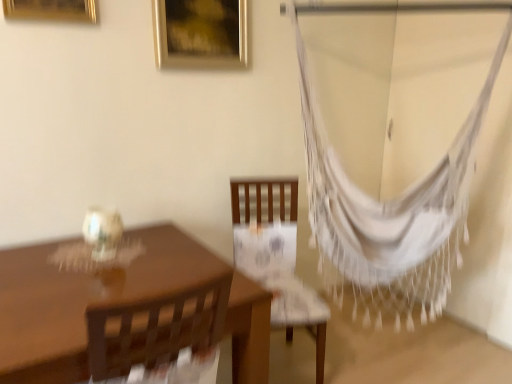
Question: Based on their positions, is white woven hammock at right located to the left or right of wooden chair at center?

Choices:
 (A) right
 (B) left

Answer: (A)

Question: Considering the positions of point (409, 200) and point (241, 187), is point (409, 200) closer or farther from the camera than point (241, 187)?

Choices:
 (A) closer
 (B) farther

Answer: (A)

Question: Estimate the real-world distances between objects in this image. Which object is closer to the matte brown table at left?

Choices:
 (A) white woven hammock at right
 (B) gold metallic picture frame at upper left, which is the second picture frame from right to left
 (C) wooden chair at center
 (D) gold metallic picture frame at upper center, arranged as the first picture frame when viewed from the back

Answer: (C)

Question: Estimate the real-world distances between objects in this image. Which object is farther from the gold metallic picture frame at upper center, the 1th picture frame viewed from the right?

Choices:
 (A) gold metallic picture frame at upper left, the 1th picture frame viewed from the front
 (B) matte brown table at left
 (C) wooden chair at center
 (D) white woven hammock at right

Answer: (B)